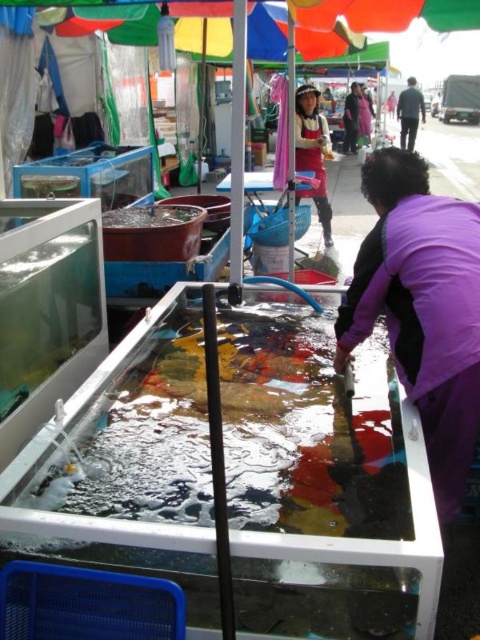
Question: Which point is closer to the camera?

Choices:
 (A) matte purple jacket at center
 (B) purple matte jacket at lower right

Answer: (B)

Question: Does purple matte jacket at lower right have a lesser width compared to matte purple jacket at center?

Choices:
 (A) yes
 (B) no

Answer: (A)

Question: Does matte purple jacket at center have a larger size compared to dark gray sweater at upper right?

Choices:
 (A) no
 (B) yes

Answer: (A)

Question: Which of these objects is positioned closest to the purple matte jacket at lower right?

Choices:
 (A) dark gray sweater at upper right
 (B) matte purple jacket at center

Answer: (B)

Question: Considering the relative positions of matte purple jacket at center and dark gray sweater at upper right in the image provided, where is matte purple jacket at center located with respect to dark gray sweater at upper right?

Choices:
 (A) right
 (B) left

Answer: (B)

Question: Which point is closer to the camera taking this photo?

Choices:
 (A) (355, 342)
 (B) (321, 177)
 (C) (420, 92)

Answer: (A)